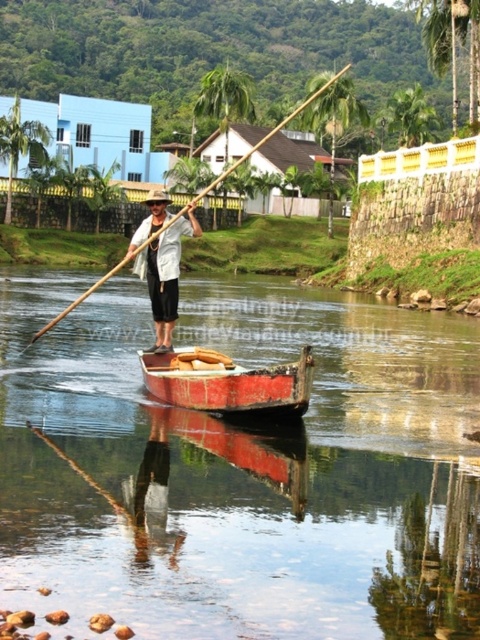
Does rusty wood canoe at center have a smaller size compared to brown wooden paddle at center?

Yes.

Is rusty wood canoe at center positioned before brown wooden paddle at center?

That is True.

Is point (204, 387) positioned before point (226, 172)?

Yes, it is in front of point (226, 172).

Find the location of `rusty wood canoe at center`. rusty wood canoe at center is located at coordinates (227, 381).

Who is lower down, rusty wood canoe at center or white matte shirt at center?

Positioned lower is rusty wood canoe at center.

Can you confirm if rusty wood canoe at center is positioned to the right of white matte shirt at center?

Indeed, rusty wood canoe at center is positioned on the right side of white matte shirt at center.

Is point (236, 412) farther from viewer compared to point (153, 352)?

No, (236, 412) is closer to viewer.

Find the location of a particular element. Image resolution: width=480 pixels, height=640 pixels. rusty wood canoe at center is located at coordinates click(x=227, y=381).

Does smooth brown water at center appear on the right side of rusty wood canoe at center?

Yes, smooth brown water at center is to the right of rusty wood canoe at center.

Does smooth brown water at center come in front of rusty wood canoe at center?

Yes, it is.

Measure the distance between point (211,560) and camera.

A distance of 31.93 meters exists between point (211,560) and camera.

At what (x,y) coordinates should I click in order to perform the action: click on smooth brown water at center. Please return your answer as a coordinate pair (x, y). Looking at the image, I should click on (240, 468).